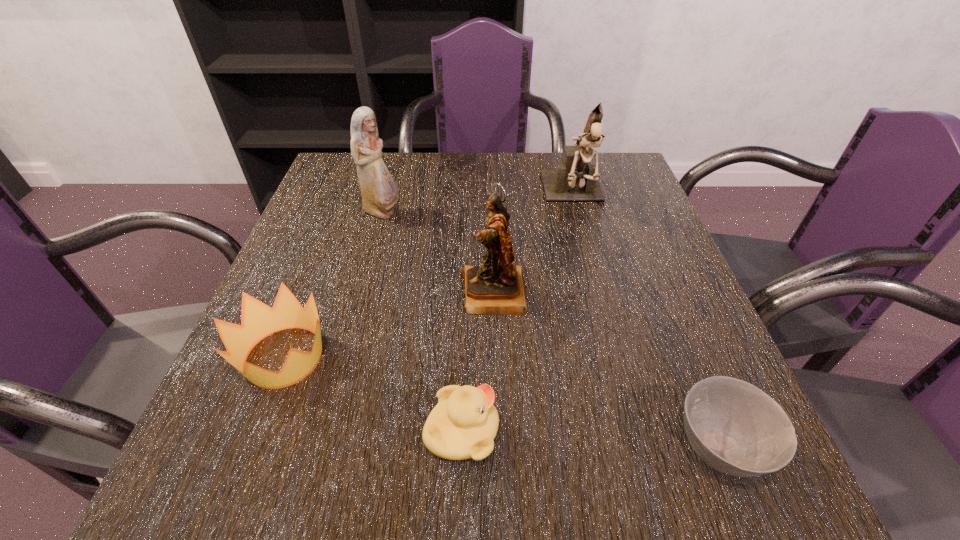
Locate an element on the screen. the third closest figurine to the crown is located at coordinates (574, 180).

Select which figurine is the third closest to the bowl. Please provide its 2D coordinates. Your answer should be formatted as a tuple, i.e. [(x, y)], where the tuple contains the x and y coordinates of a point satisfying the conditions above.

[(379, 192)]

What are the coordinates of `vacant position in the image that satisfies the following two spatial constraints: 1. on the front-facing side of the bowl; 2. on the left side of the rightmost figurine` in the screenshot? It's located at (642, 448).

Identify the location of vacant space that satisfies the following two spatial constraints: 1. on the front-facing side of the second figurine from left to right; 2. on the front side of the crown. (495, 357).

Where is `blank space that satisfies the following two spatial constraints: 1. on the front-facing side of the rightmost figurine; 2. on the front-facing side of the second figurine from right to left`? The height and width of the screenshot is (540, 960). blank space that satisfies the following two spatial constraints: 1. on the front-facing side of the rightmost figurine; 2. on the front-facing side of the second figurine from right to left is located at coordinates (600, 293).

This screenshot has width=960, height=540. I want to click on vacant region that satisfies the following two spatial constraints: 1. on the back side of the bowl; 2. on the front-facing side of the nearest figurine, so click(x=657, y=293).

Identify the location of vacant space that satisfies the following two spatial constraints: 1. on the front-facing side of the leftmost figurine; 2. on the back side of the bowl. This screenshot has width=960, height=540. (319, 448).

The height and width of the screenshot is (540, 960). I want to click on vacant space that satisfies the following two spatial constraints: 1. on the front-facing side of the rightmost figurine; 2. on the front-facing side of the second figurine from right to left, so click(x=600, y=293).